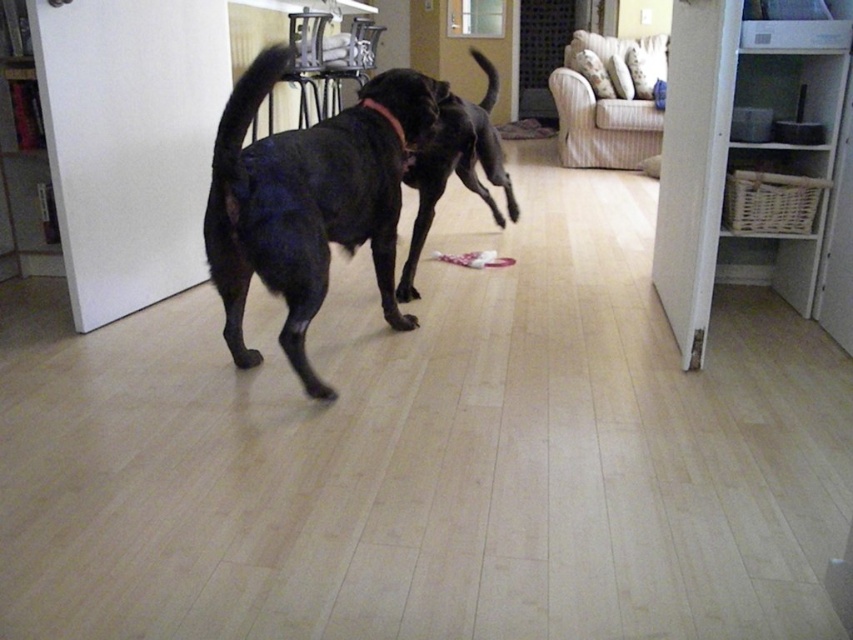
Question: Which of the following is the closest to the observer?

Choices:
 (A) black leather neckband at center
 (B) shiny black dog at center
 (C) black matte dog at center

Answer: (B)

Question: Which point appears farthest from the camera in this image?

Choices:
 (A) (488, 161)
 (B) (402, 140)
 (C) (238, 100)

Answer: (A)

Question: Is shiny black dog at center smaller than black leather neckband at center?

Choices:
 (A) yes
 (B) no

Answer: (B)

Question: Observing the image, what is the correct spatial positioning of shiny black dog at center in reference to black matte dog at center?

Choices:
 (A) above
 (B) below

Answer: (B)

Question: From the image, what is the correct spatial relationship of shiny black dog at center in relation to black leather neckband at center?

Choices:
 (A) right
 (B) left

Answer: (B)

Question: Among these points, which one is farthest from the camera?

Choices:
 (A) (222, 330)
 (B) (397, 132)

Answer: (A)